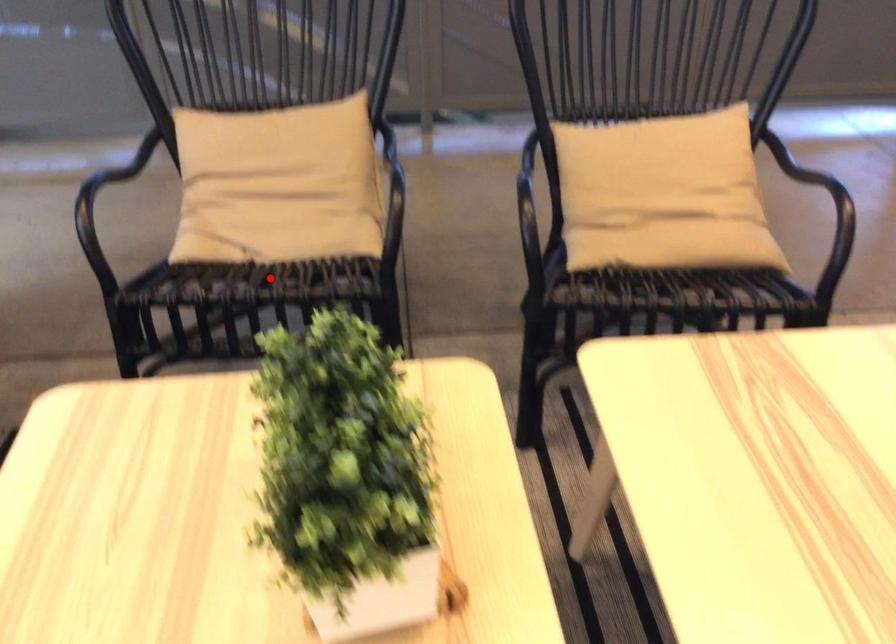
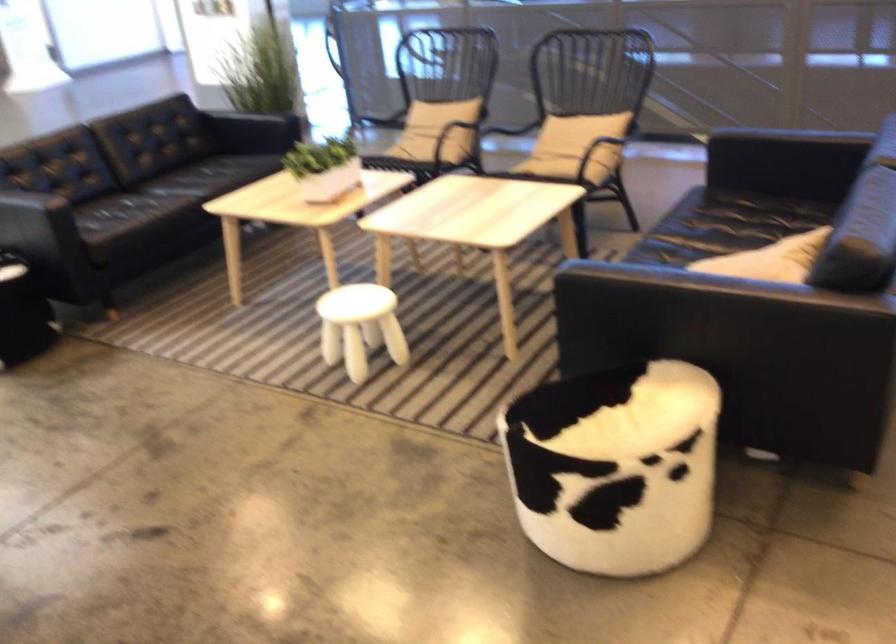
Locate, in the second image, the point that corresponds to the highlighted location in the first image.

(401, 163)